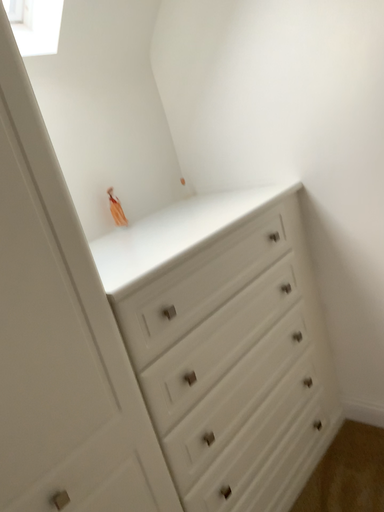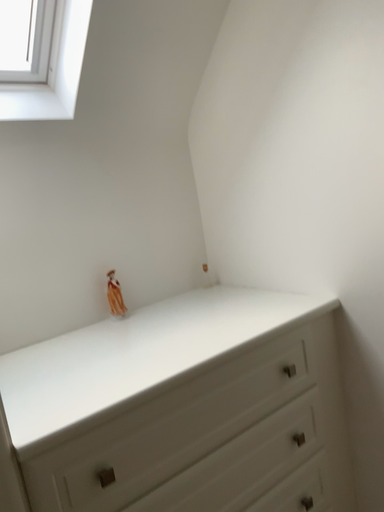
Question: Which way did the camera rotate in the video?

Choices:
 (A) rotated right
 (B) rotated left

Answer: (B)